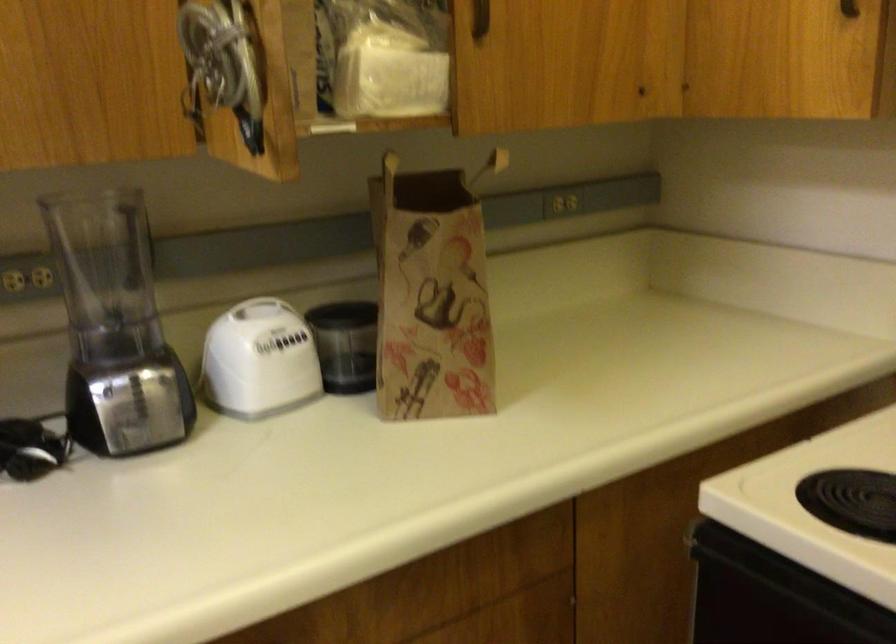
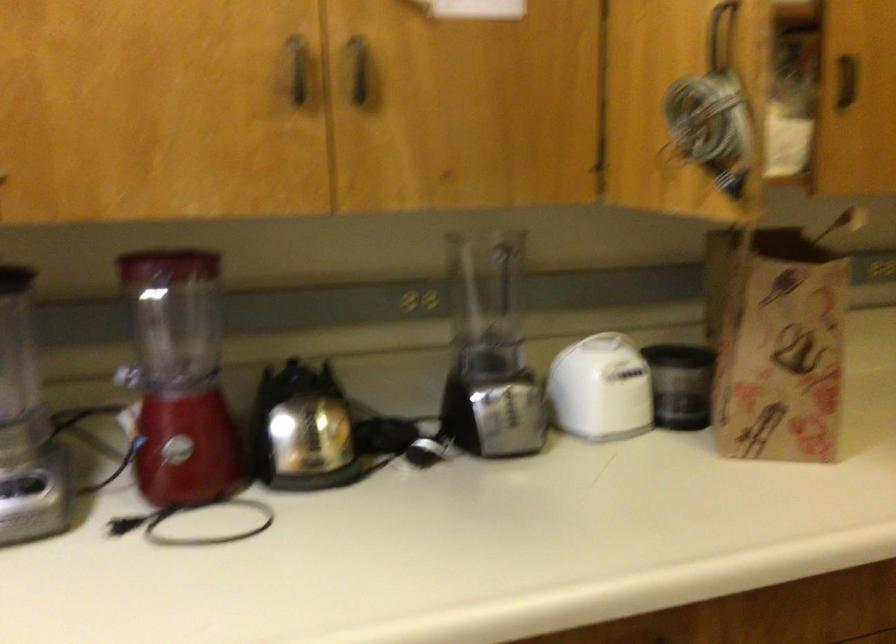
In the second image, find the point that corresponds to point (389, 163) in the first image.

(754, 214)